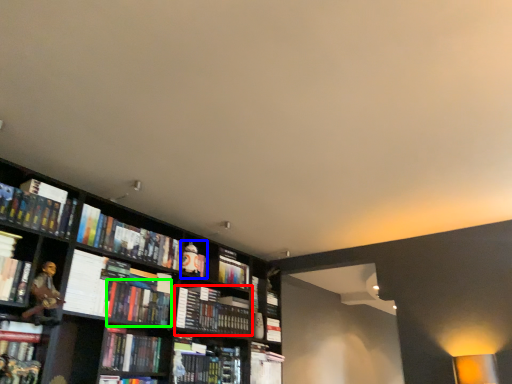
Question: Which object is positioned closest to book (highlighted by a red box)? Select from book (highlighted by a blue box) and book (highlighted by a green box).

Choices:
 (A) book
 (B) book

Answer: (A)